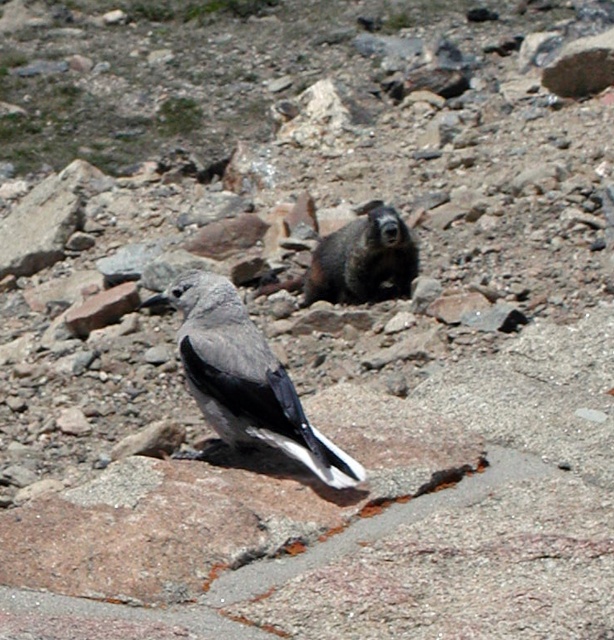
Question: Which of the following is the closest to the observer?

Choices:
 (A) brown furry rock at center
 (B) gray matte bird at center

Answer: (B)

Question: Which object is closer to the camera taking this photo?

Choices:
 (A) brown furry rock at center
 (B) gray matte bird at center

Answer: (B)

Question: Among these objects, which one is nearest to the camera?

Choices:
 (A) brown furry rock at center
 (B) gray matte bird at center

Answer: (B)

Question: Is gray matte bird at center positioned in front of brown furry rock at center?

Choices:
 (A) yes
 (B) no

Answer: (A)

Question: Is gray matte bird at center in front of brown furry rock at center?

Choices:
 (A) yes
 (B) no

Answer: (A)

Question: Is gray matte bird at center to the right of brown furry rock at center from the viewer's perspective?

Choices:
 (A) no
 (B) yes

Answer: (A)